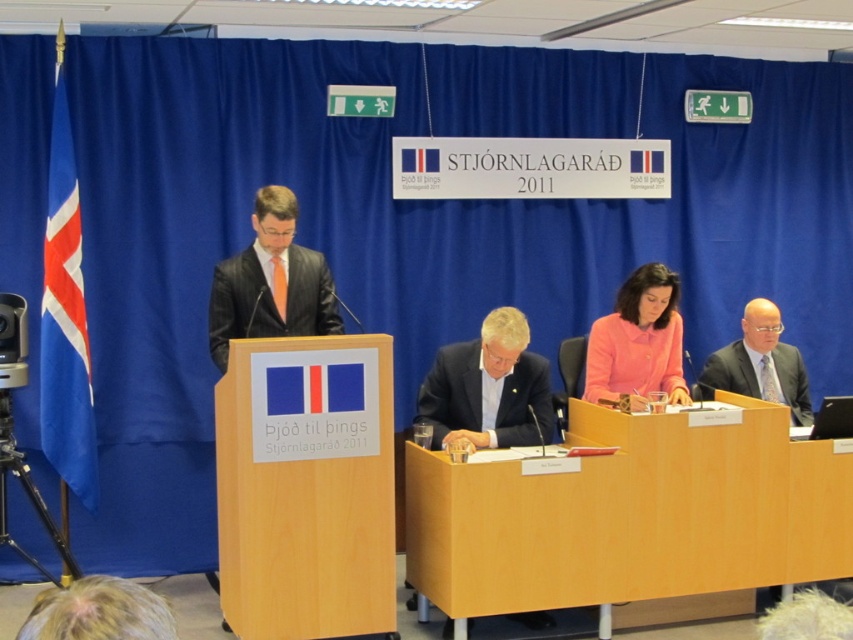
Based on the coordinates provided, which object is located at point (637, 340) in the image?

The point at (637, 340) indicates the pink fabric jacket at center.

You are organizing a photo shoot for a fashion magazine and need to position the pink fabric jacket at center and the matte black suit at right in a way that they are exactly 50 centimeters apart. Given their current distance, what adjustment should you make?

The pink fabric jacket at center and matte black suit at right are currently 55.99 centimeters apart. To achieve the desired 50 centimeter distance, you should move them closer together by approximately 6 centimeters.